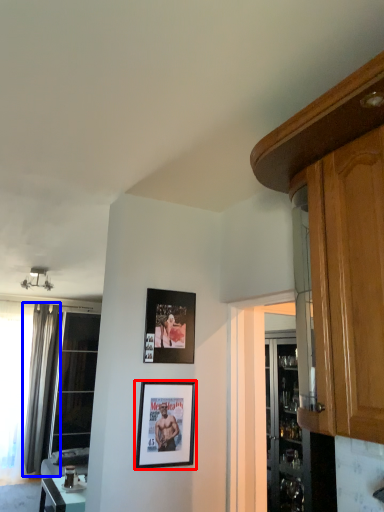
Question: Which of the following is the closest to the observer, picture frame (highlighted by a red box) or curtain (highlighted by a blue box)?

Choices:
 (A) picture frame
 (B) curtain

Answer: (A)